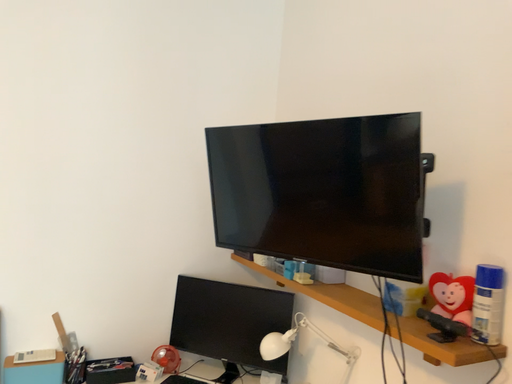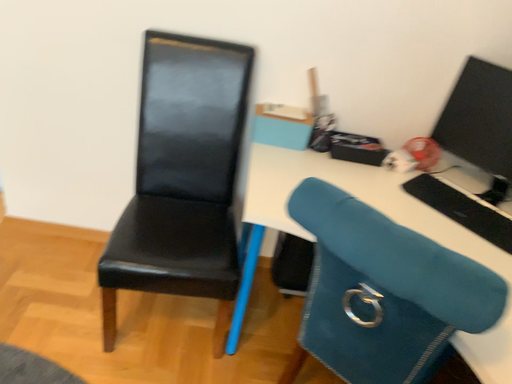
Question: Which way did the camera rotate in the video?

Choices:
 (A) rotated upward
 (B) rotated downward

Answer: (B)